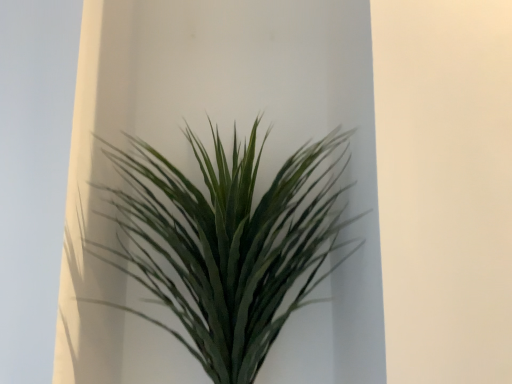
Question: Should I look upward or downward to see green matte plant at center?

Choices:
 (A) up
 (B) down

Answer: (B)